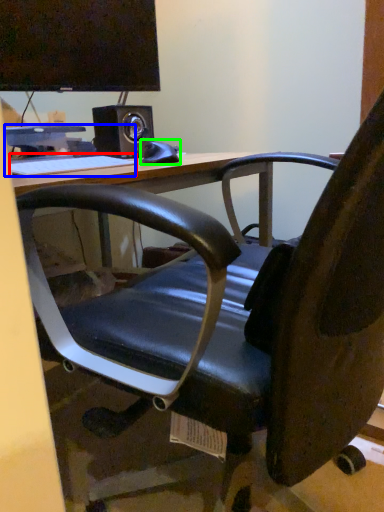
Question: Considering the real-world distances, which object is farthest from keyboard (highlighted by a red box)? computer (highlighted by a blue box) or equipment (highlighted by a green box)?

Choices:
 (A) computer
 (B) equipment

Answer: (B)